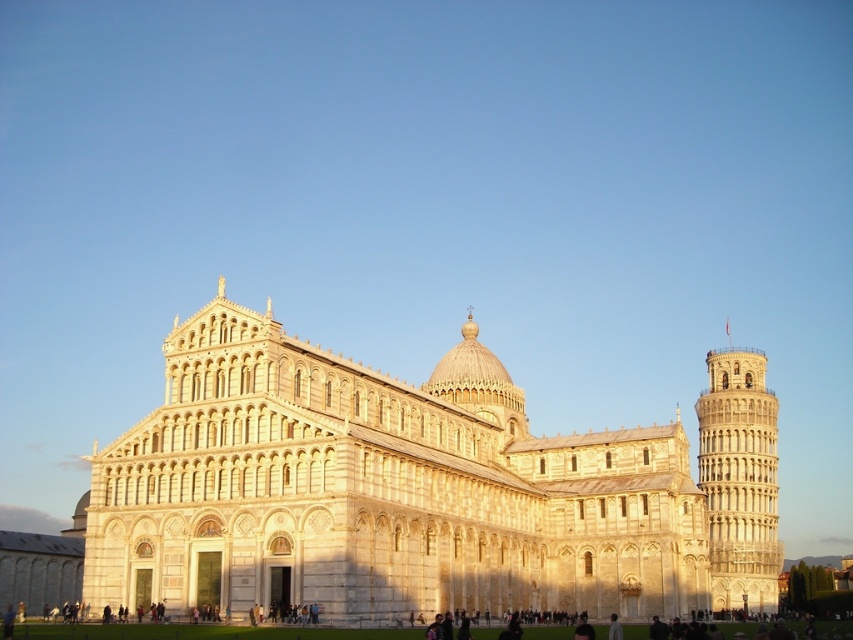
Does white stone cathedral at center appear on the left side of white stone tower at right?

Yes, white stone cathedral at center is to the left of white stone tower at right.

Does point (302, 387) come behind point (750, 609)?

No, (302, 387) is in front of (750, 609).

Is point (376, 442) farther from camera compared to point (767, 580)?

That is False.

What are the coordinates of `white stone cathedral at center` in the screenshot? It's located at (421, 490).